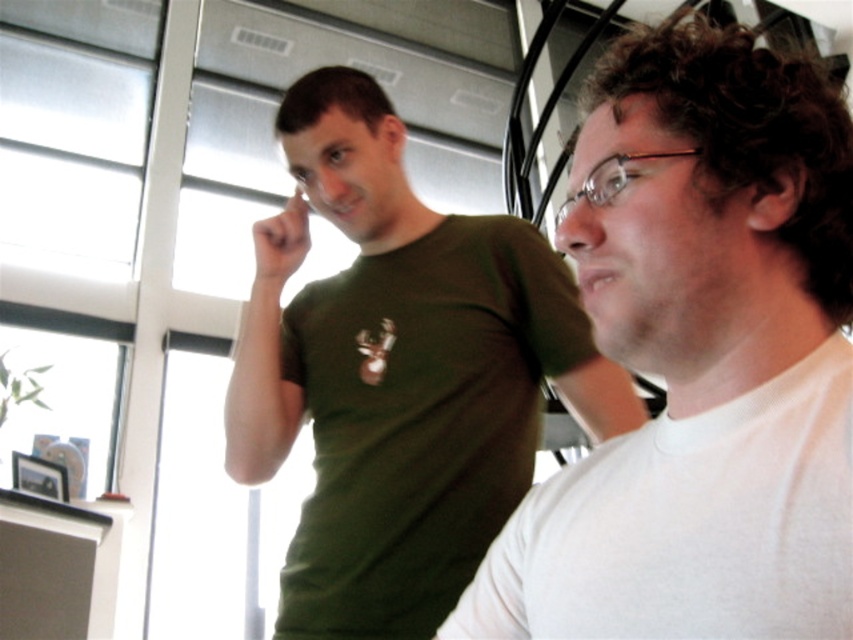
Is white matte shirt at right further to the viewer compared to green matte t-shirt at upper left?

No, white matte shirt at right is in front of green matte t-shirt at upper left.

Locate an element on the screen. The height and width of the screenshot is (640, 853). white matte shirt at right is located at coordinates (700, 358).